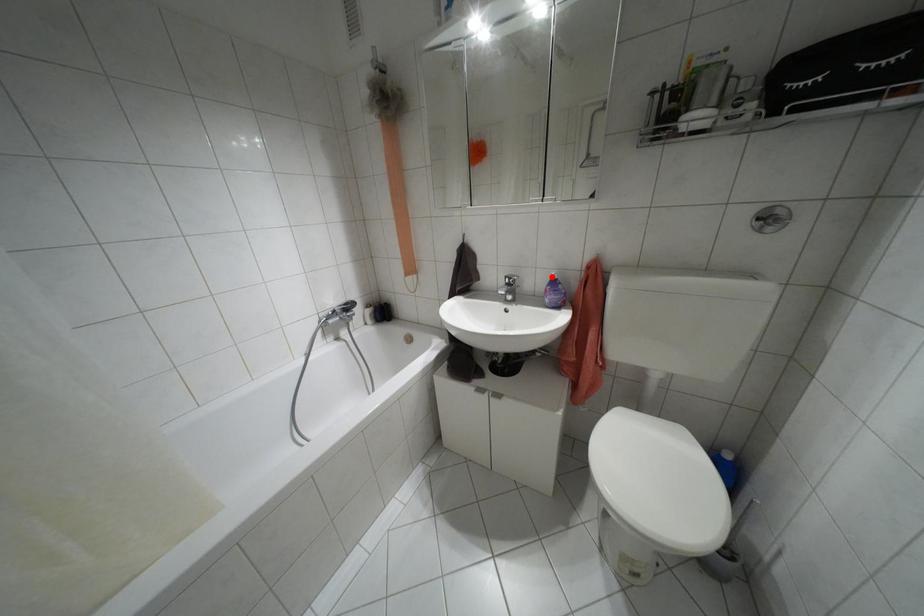
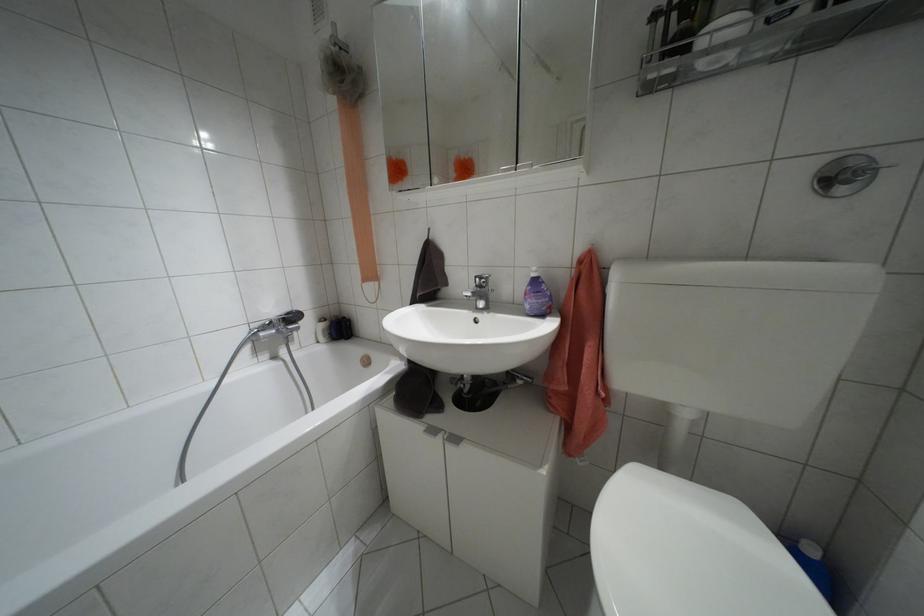
Find the pixel in the second image that matches the highlighted location in the first image.

(532, 274)